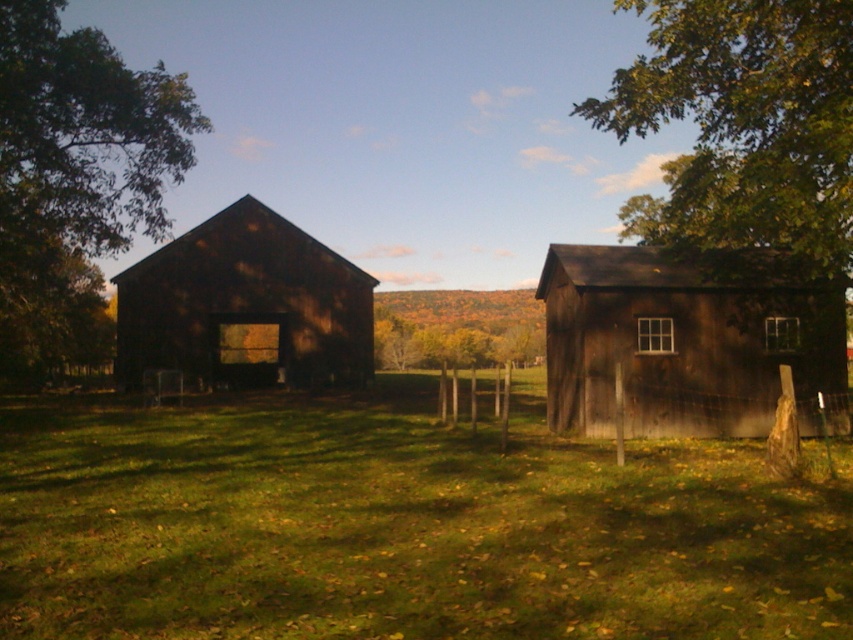
Which is in front, point (341, 627) or point (677, 29)?

Positioned in front is point (341, 627).

Which is more to the right, green grass at center or green leafy tree at upper right?

green leafy tree at upper right is more to the right.

Is point (6, 433) positioned after point (666, 209)?

No, it is not.

Locate an element on the screen. green grass at center is located at coordinates (402, 524).

Is green matte tree at left to the right of dark brown wooden barn at center from the viewer's perspective?

Incorrect, green matte tree at left is not on the right side of dark brown wooden barn at center.

Can you confirm if green matte tree at left is taller than dark brown wooden barn at center?

Yes.

This screenshot has width=853, height=640. I want to click on green matte tree at left, so click(x=74, y=179).

Where is `green matte tree at left`? green matte tree at left is located at coordinates (74, 179).

Is green grass at center taller than yellow-green leaves at center?

No.

Who is more distant from viewer, (503, 630) or (469, 310)?

Positioned behind is point (469, 310).

Which is in front, point (651, 493) or point (397, 333)?

Positioned in front is point (651, 493).

Locate an element on the screen. The height and width of the screenshot is (640, 853). green grass at center is located at coordinates (402, 524).